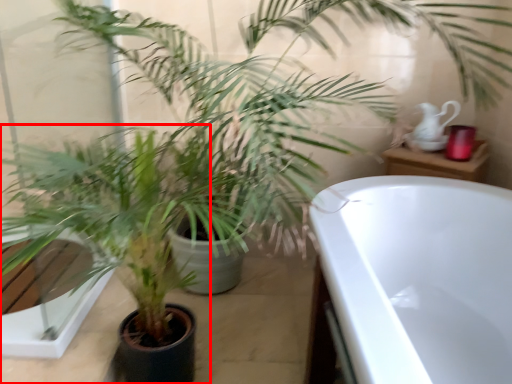
Question: Observing the image, what is the correct spatial positioning of houseplant (annotated by the red box) in reference to tea pot?

Choices:
 (A) right
 (B) left

Answer: (B)